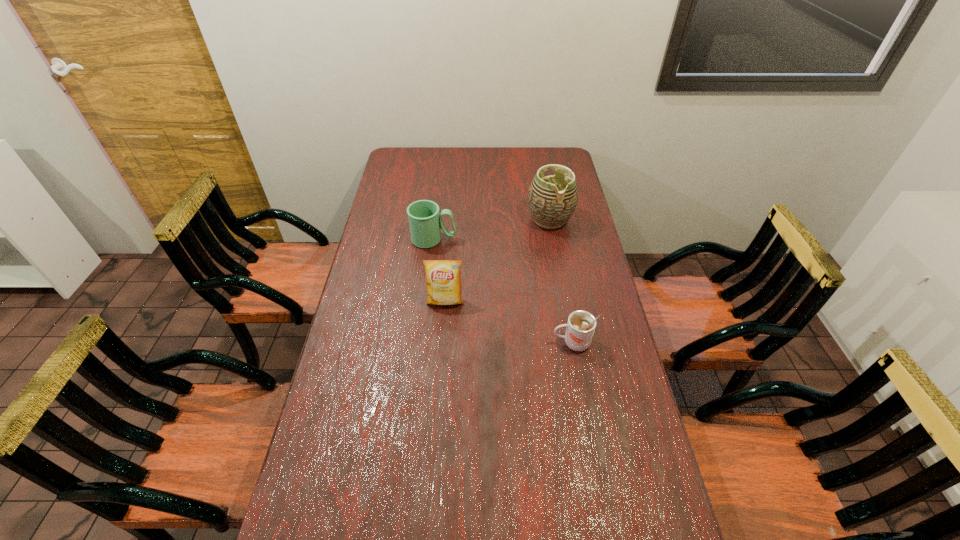
You are a GUI agent. You are given a task and a screenshot of the screen. Output one action in this format:
    pyautogui.click(x=<x>, y=<y>)
    Task: Click on the pottery
    
    Given the screenshot: What is the action you would take?
    pyautogui.click(x=552, y=200)

You are a GUI agent. You are given a task and a screenshot of the screen. Output one action in this format:
    pyautogui.click(x=<x>, y=<y>)
    Task: Click on the crisp (potato chip)
    
    Given the screenshot: What is the action you would take?
    pyautogui.click(x=443, y=277)

Identify the location of mug. (425, 221).

Where is `the nearest object`? The image size is (960, 540). the nearest object is located at coordinates (581, 325).

This screenshot has height=540, width=960. What are the coordinates of `vacant space located 0.380m on the left of the pottery` in the screenshot? It's located at (434, 220).

Locate an element on the screen. This screenshot has width=960, height=540. free point located on the front-facing side of the second nearest object is located at coordinates (439, 392).

The height and width of the screenshot is (540, 960). What are the coordinates of `vacant position located 0.370m on the side of the mug with the handle` in the screenshot? It's located at (550, 240).

Identify the location of vacant space located on the side with the handle of the cup. The image size is (960, 540). (479, 343).

Identify the location of vacant space located on the side with the handle of the cup. (425, 343).

The width and height of the screenshot is (960, 540). Identify the location of vacant space located on the side with the handle of the cup. (489, 343).